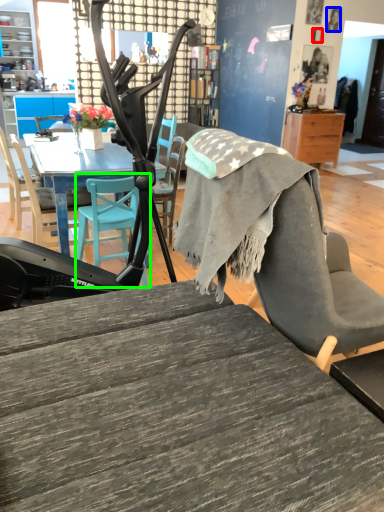
Question: Estimate the real-world distances between objects in this image. Which object is farther from picture frame (highlighted by a red box), person (highlighted by a blue box) or chair (highlighted by a green box)?

Choices:
 (A) person
 (B) chair

Answer: (B)